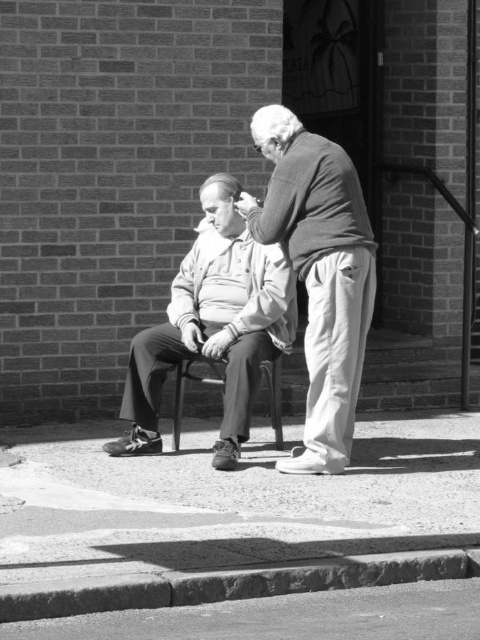
You are a photographer standing at the edge of the street. You want to take a photo of the metallic black chair at center without the smooth concrete pavement at lower center appearing in the frame. Is this possible given their positions?

The smooth concrete pavement at lower center is positioned under the metallic black chair at center, so it is likely that the pavement will be visible beneath the chair in the photo. To avoid including the pavement, you might need to adjust your angle or use a different background.

You are standing at the point marked as point (245, 540) in the image. What is directly beneath your feet?

The smooth concrete pavement at lower center is located at point (245, 540), so the smooth concrete pavement at lower center is directly beneath your feet.